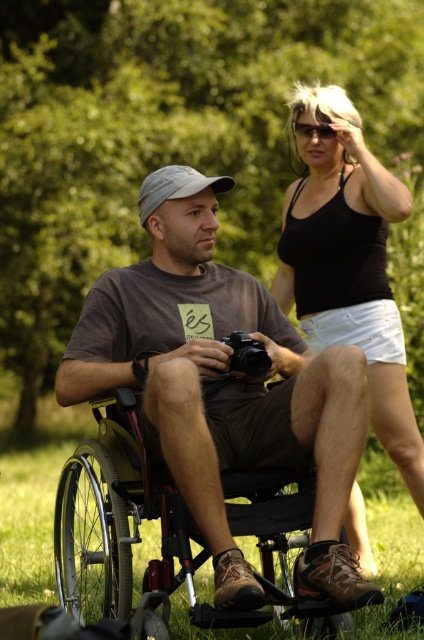
You are a photographer trying to capture both the matte brown wheelchair at center and the metallic silver wheelchair at lower left in a single frame. Based on their positions, which wheelchair should you focus on first to ensure both are in the shot?

The matte brown wheelchair at center is in front of the metallic silver wheelchair at lower left, so you should focus on the metallic silver wheelchair at lower left first to ensure both are visible in the frame.

You are standing in the park and see two points marked in the image. Which point is nearer to you, point (x=172, y=552) or point (x=167, y=182)?

Point (x=172, y=552) is closer to the viewer than point (x=167, y=182).